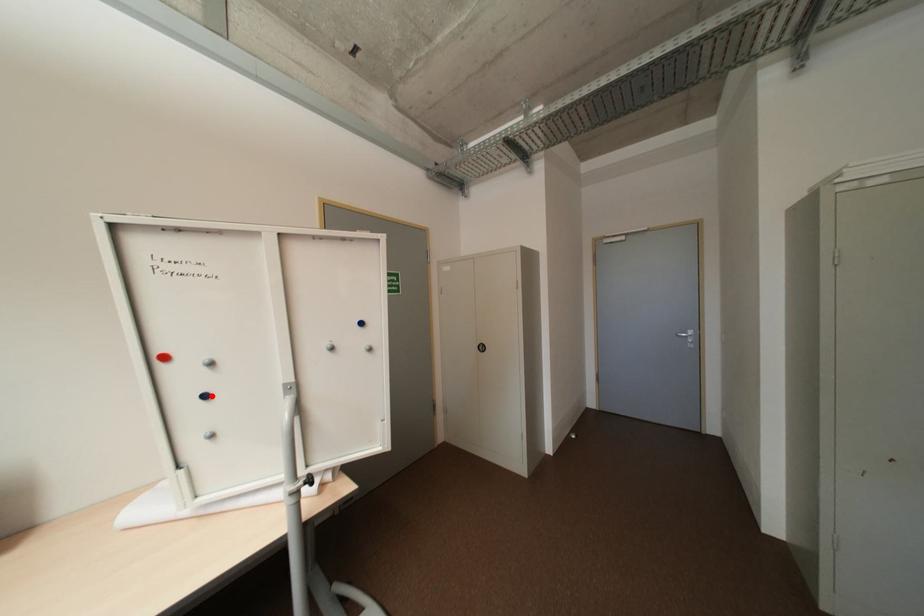
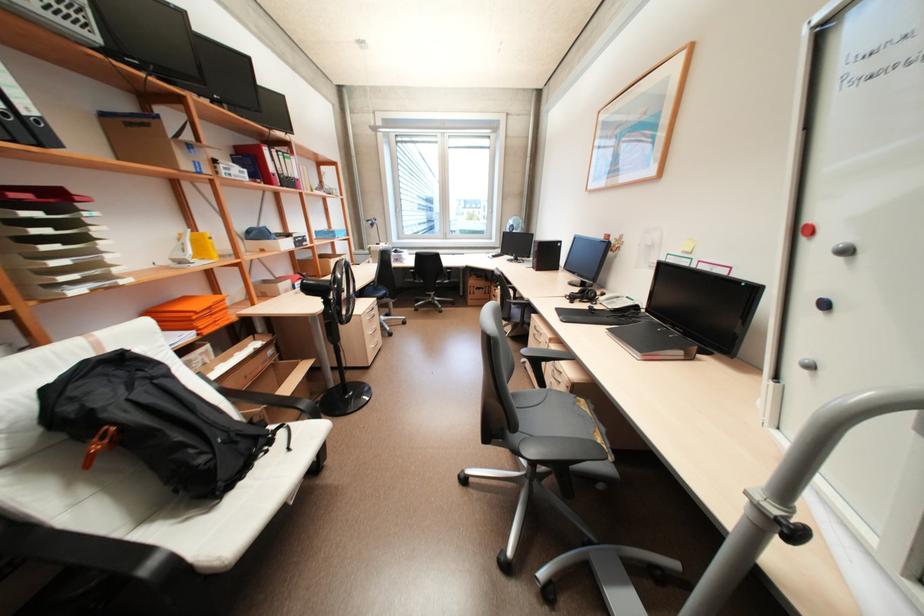
Find the pixel in the second image that matches the highlighted location in the first image.

(830, 304)